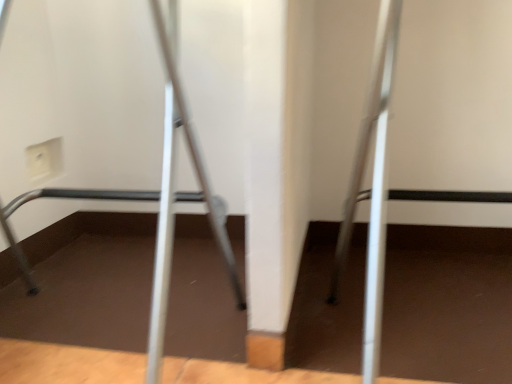
Image resolution: width=512 pixels, height=384 pixels. I want to click on silver metallic ladder at center, so click(170, 196).

Measure the distance between point (178, 100) and camera.

Point (178, 100) and camera are 71.20 centimeters apart from each other.

What do you see at coordinates (170, 196) in the screenshot? The height and width of the screenshot is (384, 512). I see `silver metallic ladder at center` at bounding box center [170, 196].

You are a GUI agent. You are given a task and a screenshot of the screen. Output one action in this format:
    pyautogui.click(x=<x>, y=<y>)
    Task: Click on the silver metallic ladder at center
    
    Given the screenshot: What is the action you would take?
    pyautogui.click(x=170, y=196)